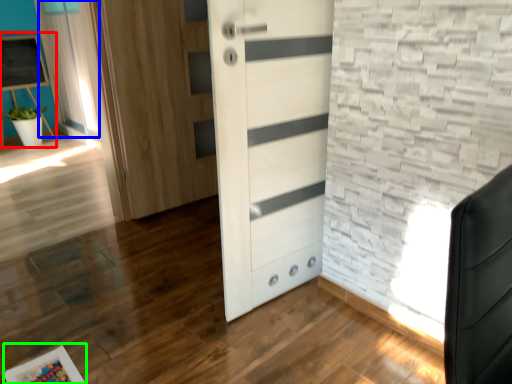
Question: Considering the real-world distances, which object is closest to bulletin board (highlighted by a red box)? curtain (highlighted by a blue box) or picture frame (highlighted by a green box).

Choices:
 (A) curtain
 (B) picture frame

Answer: (A)